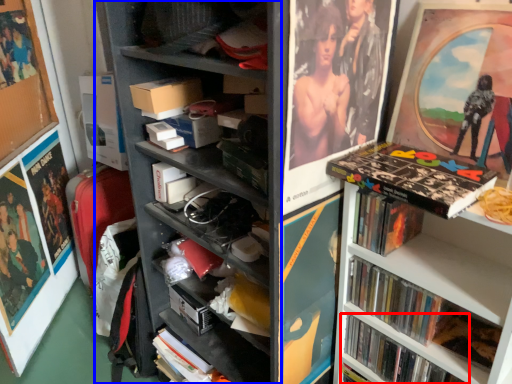
Question: Among these objects, which one is farthest to the camera, book (highlighted by a red box) or bookshelf (highlighted by a blue box)?

Choices:
 (A) book
 (B) bookshelf

Answer: (A)